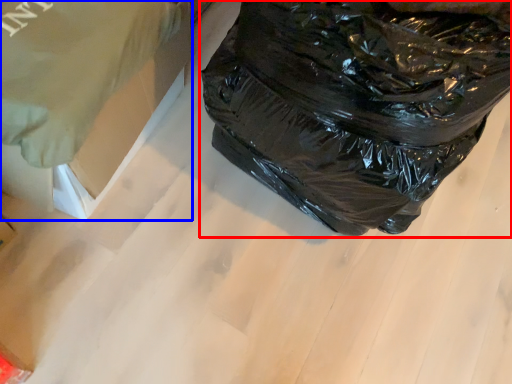
Question: Which object is closer to the camera taking this photo, plastic bag (highlighted by a red box) or cardboard box (highlighted by a blue box)?

Choices:
 (A) plastic bag
 (B) cardboard box

Answer: (A)